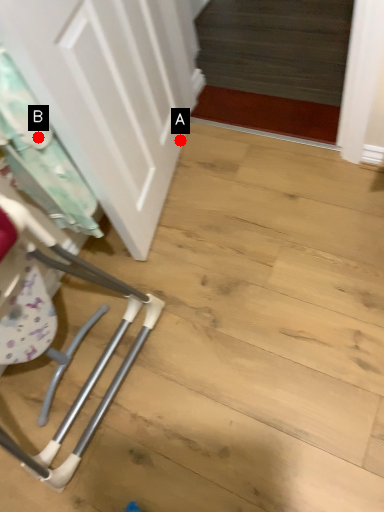
Question: Two points are circled on the image, labeled by A and B beside each circle. Among these points, which one is nearest to the camera?

Choices:
 (A) A is closer
 (B) B is closer

Answer: (B)